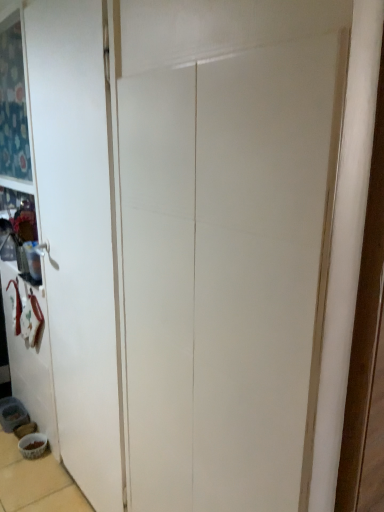
This screenshot has height=512, width=384. Describe the element at coordinates (78, 236) in the screenshot. I see `white matte door at left` at that location.

Measure the distance between white matte door at left and camera.

white matte door at left and camera are 1.14 meters apart.

Identify the location of white matte door at left. (78, 236).

Describe the element at coordinates (33, 445) in the screenshot. I see `white glossy bowl at lower left` at that location.

What are the coordinates of `white glossy bowl at lower left` in the screenshot? It's located at (33, 445).

Where is `white matte door at left`? This screenshot has height=512, width=384. white matte door at left is located at coordinates (78, 236).

Which object is positioned more to the right, white glossy bowl at lower left or white matte door at left?

white matte door at left is more to the right.

From the picture: Considering their positions, is white glossy bowl at lower left located in front of or behind white matte door at left?

white glossy bowl at lower left is behind white matte door at left.

Does point (30, 438) come closer to viewer compared to point (53, 236)?

No.

From the image's perspective, which is below, white glossy bowl at lower left or white matte door at left?

white glossy bowl at lower left, from the image's perspective.

From a real-world perspective, is white glossy bowl at lower left physically below white matte door at left?

Yes, from a real-world perspective, white glossy bowl at lower left is below white matte door at left.

Does white glossy bowl at lower left have a greater width compared to white matte door at left?

Indeed, white glossy bowl at lower left has a greater width compared to white matte door at left.

In the scene shown: Is white glossy bowl at lower left shorter than white matte door at left?

Yes.

Who is bigger, white glossy bowl at lower left or white matte door at left?

With larger size is white matte door at left.

Is white glossy bowl at lower left located outside white matte door at left?

Absolutely, white glossy bowl at lower left is external to white matte door at left.

Does white glossy bowl at lower left touch white matte door at left?

They are not placed beside each other.

Is white glossy bowl at lower left oriented towards white matte door at left?

No.

In the image, there is a white matte door at left. What are the coordinates of `bowl below it (from the image's perspective)` in the screenshot? It's located at (33, 445).

Can you confirm if white matte door at left is positioned to the right of white glossy bowl at lower left?

Yes.

Considering the positions of objects white matte door at left and white glossy bowl at lower left in the image provided, who is in front, white matte door at left or white glossy bowl at lower left?

white matte door at left is in front.

Does point (36, 39) come behind point (37, 443)?

No, it is in front of (37, 443).

From the image's perspective, is white matte door at left on top of white glossy bowl at lower left?

Yes.

From a real-world perspective, between white matte door at left and white glossy bowl at lower left, who is vertically higher?

In real-world perspective, white matte door at left is above.

Which object is wider, white matte door at left or white glossy bowl at lower left?

white glossy bowl at lower left.

Who is taller, white matte door at left or white glossy bowl at lower left?

white matte door at left.

Considering the sizes of objects white matte door at left and white glossy bowl at lower left in the image provided, who is smaller, white matte door at left or white glossy bowl at lower left?

With smaller size is white glossy bowl at lower left.

Could white glossy bowl at lower left be considered to be inside white matte door at left?

No, white glossy bowl at lower left is not inside white matte door at left.

Is white matte door at left next to white glossy bowl at lower left and touching it?

No, white matte door at left is not making contact with white glossy bowl at lower left.

Is white matte door at left looking in the opposite direction of white glossy bowl at lower left?

No, white matte door at left is not facing away from white glossy bowl at lower left.

What's the angular difference between white matte door at left and white glossy bowl at lower left's facing directions?

white matte door at left and white glossy bowl at lower left are facing 1.67 degrees away from each other.

Identify the location of bowl behind the white matte door at left. (33, 445).

The height and width of the screenshot is (512, 384). I want to click on bowl below the white matte door at left (from a real-world perspective), so click(x=33, y=445).

The height and width of the screenshot is (512, 384). In order to click on door in front of the white glossy bowl at lower left in this screenshot , I will do `click(78, 236)`.